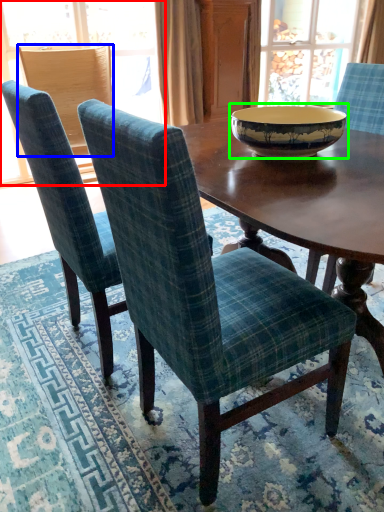
Question: Estimate the real-world distances between objects in this image. Which object is farther from window (highlighted by a red box), chair (highlighted by a blue box) or bowl (highlighted by a green box)?

Choices:
 (A) chair
 (B) bowl

Answer: (B)